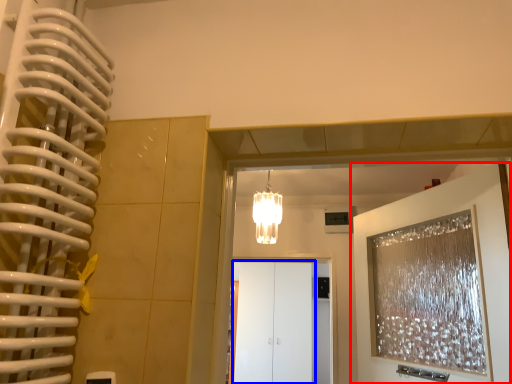
Question: Which object is further to the camera taking this photo, door (highlighted by a red box) or glass door (highlighted by a blue box)?

Choices:
 (A) door
 (B) glass door

Answer: (B)